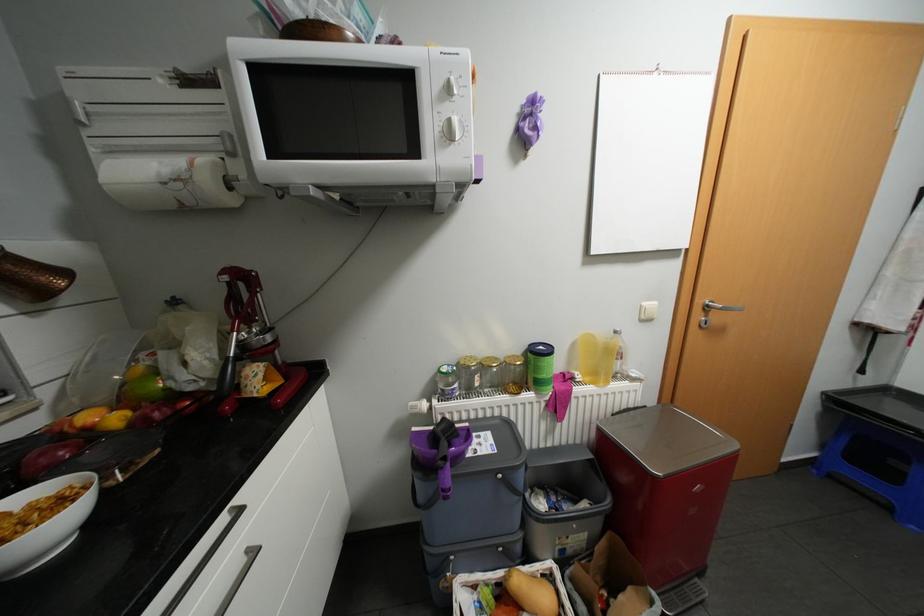
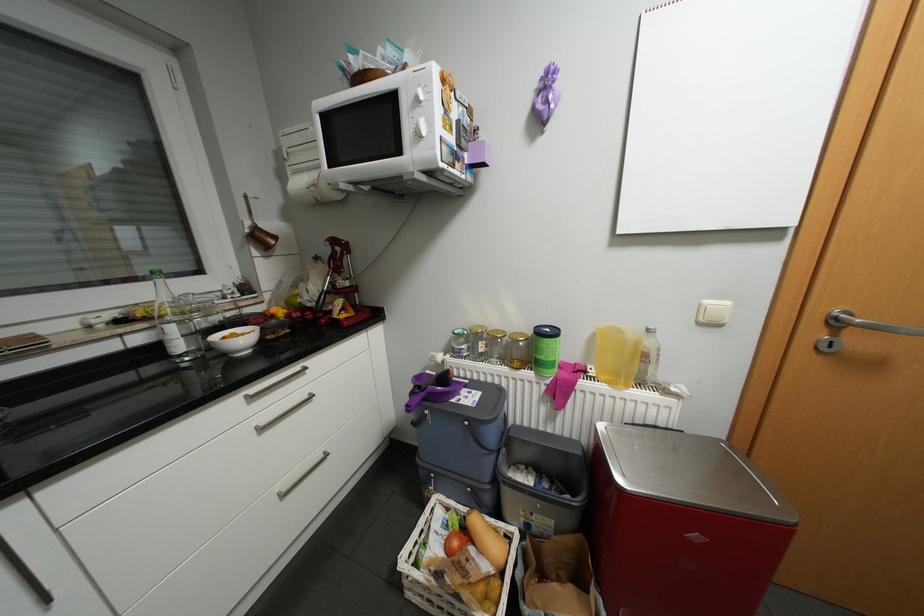
Question: How did the camera likely rotate?

Choices:
 (A) Left
 (B) Right
 (C) Up
 (D) Down

Answer: (A)